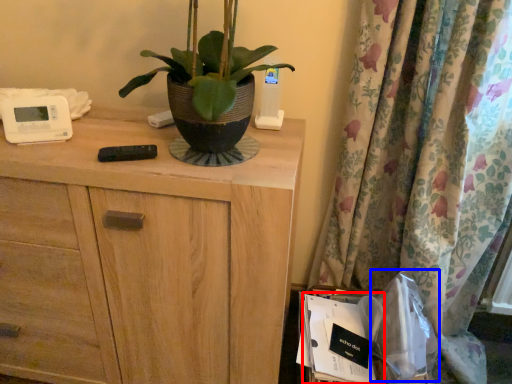
Question: Which point is closer to the camera, paperback book (highlighted by a red box) or paper bag (highlighted by a blue box)?

Choices:
 (A) paperback book
 (B) paper bag

Answer: (B)